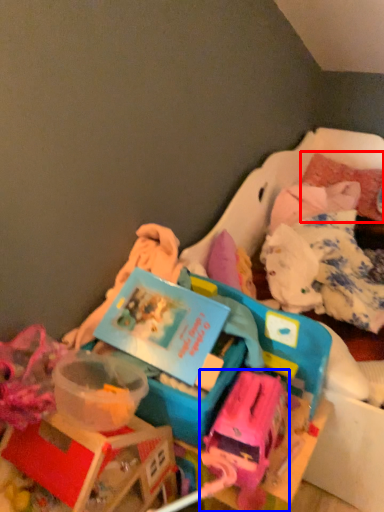
Question: Which object is closer to the camera taking this photo, pillow (highlighted by a red box) or toy (highlighted by a blue box)?

Choices:
 (A) pillow
 (B) toy

Answer: (B)